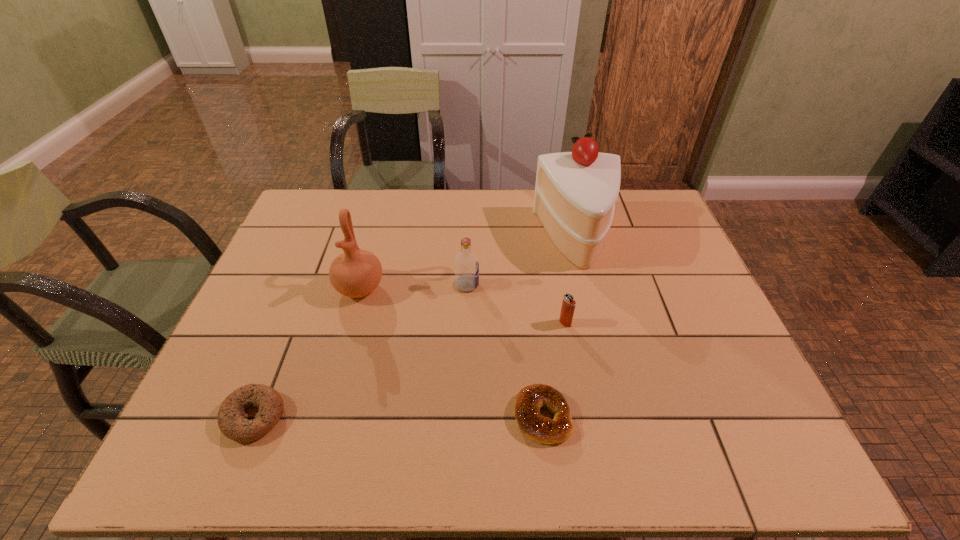
Identify the location of vacant area that lies between the leftmost object and the fourth object from right to left. (361, 350).

Locate an element on the screen. unoccupied position between the right bagel and the left bagel is located at coordinates (398, 416).

Find the location of a particular element. This screenshot has width=960, height=540. free space between the tallest object and the fourth tallest object is located at coordinates (571, 281).

Where is `vacant space in between the left bagel and the tallest object`? This screenshot has height=540, width=960. vacant space in between the left bagel and the tallest object is located at coordinates (416, 327).

Find the location of `empty space that is in between the fourth tallest object and the fifth shortest object`. empty space that is in between the fourth tallest object and the fifth shortest object is located at coordinates (463, 306).

Identify which object is located as the fifth nearest to the right bagel. Please provide its 2D coordinates. Your answer should be formatted as a tuple, i.e. [(x, y)], where the tuple contains the x and y coordinates of a point satisfying the conditions above.

[(231, 416)]

Select which object is the closest to the second tallest object. Please provide its 2D coordinates. Your answer should be formatted as a tuple, i.e. [(x, y)], where the tuple contains the x and y coordinates of a point satisfying the conditions above.

[(466, 262)]

Identify the location of free space that satisfies the following two spatial constraints: 1. on the label of the fourth farthest object; 2. on the left side of the vodka. (467, 323).

The width and height of the screenshot is (960, 540). I want to click on vacant space that satisfies the following two spatial constraints: 1. on the spout of the third shortest object; 2. on the left side of the second object from left to right, so click(350, 323).

What are the coordinates of `free space in the image that satisfies the following two spatial constraints: 1. on the label of the vodka; 2. on the back side of the igniter` in the screenshot? It's located at (467, 323).